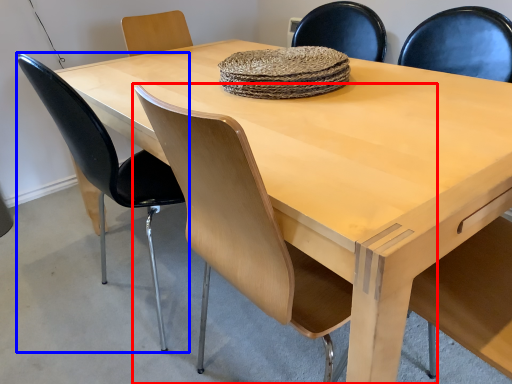
Question: Which of the following is the closest to the observer, chair (highlighted by a red box) or chair (highlighted by a blue box)?

Choices:
 (A) chair
 (B) chair

Answer: (A)